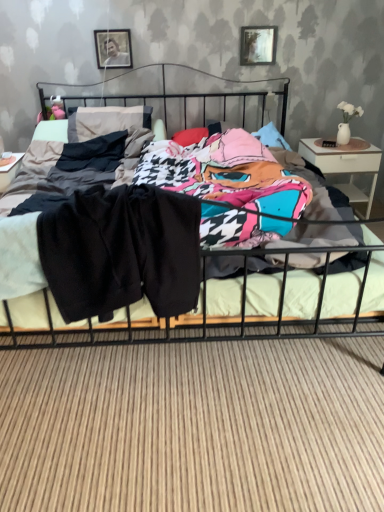
Question: Does metallic silver picture frame at upper center, which is the first picture frame in right-to-left order, contain metallic silver picture frame at upper center, the 1th picture frame in the left-to-right sequence?

Choices:
 (A) no
 (B) yes

Answer: (A)

Question: Does metallic silver picture frame at upper center, the 2th picture frame in the left-to-right sequence, lie in front of metallic silver picture frame at upper center, the 1th picture frame in the left-to-right sequence?

Choices:
 (A) yes
 (B) no

Answer: (B)

Question: Does metallic silver picture frame at upper center, the 2th picture frame in the left-to-right sequence, have a lesser width compared to metallic silver picture frame at upper center, which ranks as the second picture frame in right-to-left order?

Choices:
 (A) yes
 (B) no

Answer: (A)

Question: Is the depth of metallic silver picture frame at upper center, which is the first picture frame in right-to-left order, greater than that of metallic silver picture frame at upper center, the 1th picture frame in the left-to-right sequence?

Choices:
 (A) yes
 (B) no

Answer: (A)

Question: Is metallic silver picture frame at upper center, which is the first picture frame in right-to-left order, to the right of metallic silver picture frame at upper center, the 1th picture frame in the left-to-right sequence, from the viewer's perspective?

Choices:
 (A) no
 (B) yes

Answer: (B)

Question: In the image, is black cotton pants at center on the left side or the right side of metallic silver picture frame at upper center, the 1th picture frame in the left-to-right sequence?

Choices:
 (A) right
 (B) left

Answer: (A)

Question: In terms of width, does black cotton pants at center look wider or thinner when compared to metallic silver picture frame at upper center, the 1th picture frame in the left-to-right sequence?

Choices:
 (A) wide
 (B) thin

Answer: (A)

Question: From the image's perspective, relative to metallic silver picture frame at upper center, the 1th picture frame in the left-to-right sequence, is black cotton pants at center above or below?

Choices:
 (A) below
 (B) above

Answer: (A)

Question: Considering the positions of black cotton pants at center and metallic silver picture frame at upper center, the 1th picture frame in the left-to-right sequence, in the image, is black cotton pants at center bigger or smaller than metallic silver picture frame at upper center, the 1th picture frame in the left-to-right sequence,?

Choices:
 (A) big
 (B) small

Answer: (A)

Question: From their relative heights in the image, would you say white glossy nightstand at right is taller or shorter than black cotton pants at center?

Choices:
 (A) tall
 (B) short

Answer: (A)

Question: From a real-world perspective, is white glossy nightstand at right positioned above or below black cotton pants at center?

Choices:
 (A) below
 (B) above

Answer: (A)

Question: From the image's perspective, relative to black cotton pants at center, is white glossy nightstand at right above or below?

Choices:
 (A) below
 (B) above

Answer: (B)

Question: Is point (375, 152) closer or farther from the camera than point (183, 298)?

Choices:
 (A) closer
 (B) farther

Answer: (B)

Question: Is point (273, 56) positioned closer to the camera than point (223, 104)?

Choices:
 (A) farther
 (B) closer

Answer: (B)

Question: From a real-world perspective, is metallic silver picture frame at upper center, the 2th picture frame in the left-to-right sequence, physically located above or below metallic black bed at center?

Choices:
 (A) below
 (B) above

Answer: (B)